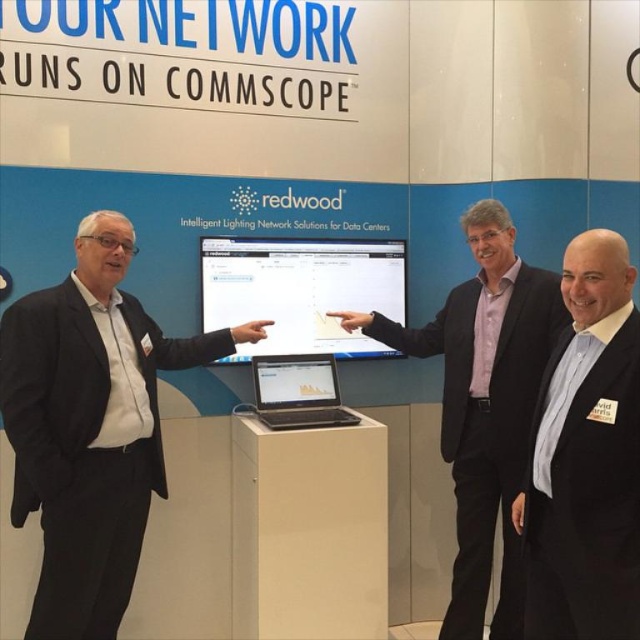
You are a photographer at the event and need to take a group photo of the black suit at left and the pink fabric shirt at center. The camera you have can focus on subjects within a 1 meter range. Will both subjects be in focus if you position the camera exactly between them?

The black suit at left and pink fabric shirt at center are 1.10 meters apart. Positioning the camera exactly between them would mean each subject is 0.55 meters from the camera. Since the camera can focus within 1 meter, both will be in focus.